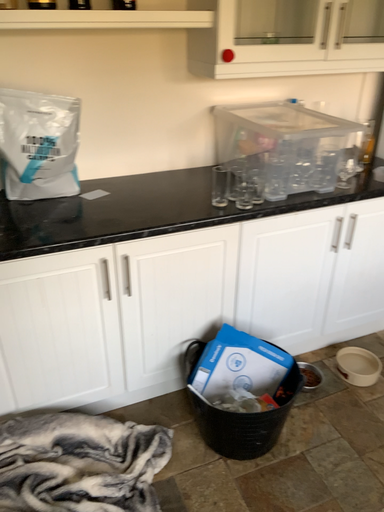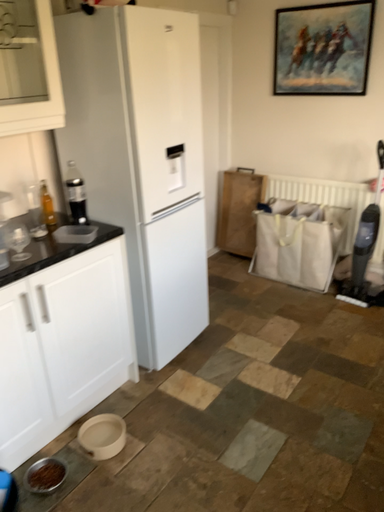
Question: How did the camera likely rotate when shooting the video?

Choices:
 (A) rotated left
 (B) rotated right

Answer: (B)